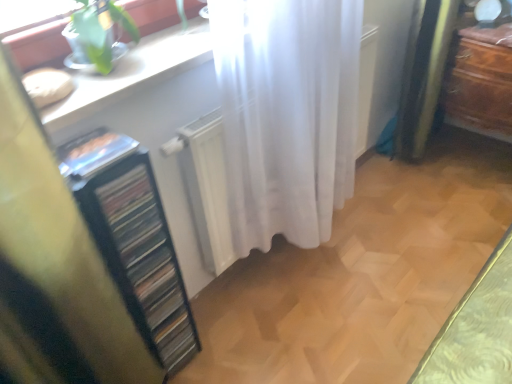
I want to click on vacant position to the left of brown wooden dresser at right, so click(419, 183).